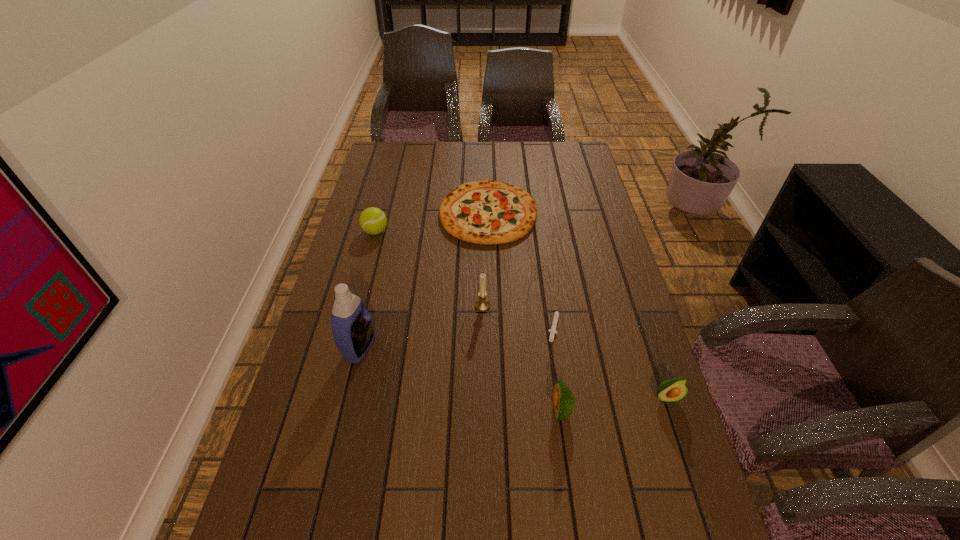
Identify the location of blank space at the far edge of the desktop. (419, 161).

Where is `free space at the near edge`? The height and width of the screenshot is (540, 960). free space at the near edge is located at coordinates (602, 532).

The image size is (960, 540). What are the coordinates of `free space at the left edge of the desktop` in the screenshot? It's located at (310, 413).

Where is `free region at the right edge of the desktop`? free region at the right edge of the desktop is located at coordinates (583, 233).

In the image, there is a desktop. Identify the location of vacant space at the near left corner. The width and height of the screenshot is (960, 540). (330, 511).

The width and height of the screenshot is (960, 540). In the image, there is a desktop. Find the location of `vacant space at the far right corner`. vacant space at the far right corner is located at coordinates (579, 166).

Find the location of a particular element. empty space that is in between the tallest object and the left avocado is located at coordinates (460, 379).

I want to click on free space between the tennis ball and the shortest object, so (x=465, y=278).

Image resolution: width=960 pixels, height=540 pixels. What are the coordinates of `empty location between the syringe and the pizza` in the screenshot? It's located at (521, 268).

You are a GUI agent. You are given a task and a screenshot of the screen. Output one action in this format:
    pyautogui.click(x=<x>, y=<y>)
    Task: Click on the vacant area that lies between the left avocado and the candle holder
    The image size is (960, 540).
    Given the screenshot: What is the action you would take?
    pyautogui.click(x=521, y=358)